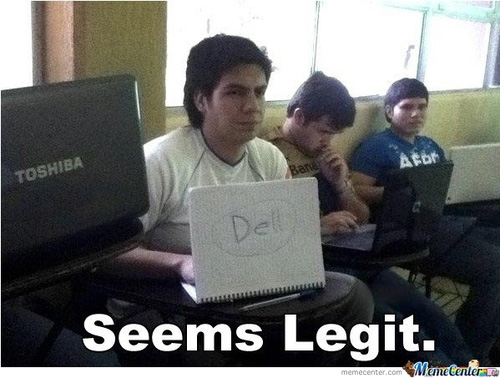
Where is `wall`? This screenshot has width=500, height=378. wall is located at coordinates (121, 49), (371, 116), (462, 117).